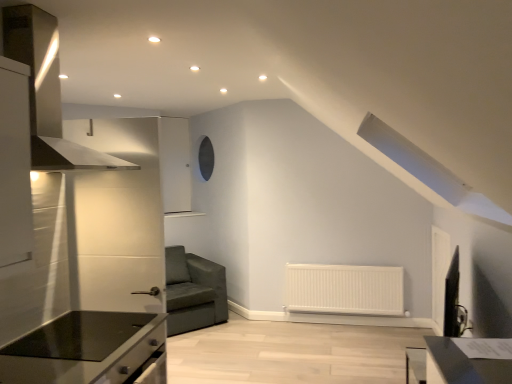
You are a GUI agent. You are given a task and a screenshot of the screen. Output one action in this format:
    pyautogui.click(x=<x>, y=<y>)
    Task: Click on the white matte radiator at lower center
    This screenshot has height=384, width=512.
    Given the screenshot: What is the action you would take?
    pyautogui.click(x=344, y=289)

Measure the distance between point (192,313) and camera.

They are 4.46 meters apart.

Image resolution: width=512 pixels, height=384 pixels. I want to click on white matte radiator at lower center, so [x=344, y=289].

Is black glass countertop at lower left at the back of stainless steel exhaust hood at left?

No.

Considering the sizes of objects stainless steel exhaust hood at left and black glass countertop at lower left in the image provided, who is bigger, stainless steel exhaust hood at left or black glass countertop at lower left?

With larger size is stainless steel exhaust hood at left.

From the picture: From a real-world perspective, which is physically above, stainless steel exhaust hood at left or black glass countertop at lower left?

In real-world perspective, stainless steel exhaust hood at left is above.

Considering the sizes of objects stainless steel exhaust hood at left and black glass countertop at lower left in the image provided, who is shorter, stainless steel exhaust hood at left or black glass countertop at lower left?

Standing shorter between the two is black glass countertop at lower left.

Is dark gray fabric couch at lower left inside or outside of white matte radiator at lower center?

dark gray fabric couch at lower left is not enclosed by white matte radiator at lower center.

Which object is positioned more to the right, dark gray fabric couch at lower left or white matte radiator at lower center?

white matte radiator at lower center is more to the right.

In terms of height, does dark gray fabric couch at lower left look taller or shorter compared to white matte radiator at lower center?

Considering their sizes, dark gray fabric couch at lower left has more height than white matte radiator at lower center.

Is point (185, 255) closer or farther from the camera than point (311, 291)?

Point (185, 255) is farther from the camera than point (311, 291).

Does white matte radiator at lower center have a lesser width compared to stainless steel exhaust hood at left?

Indeed, white matte radiator at lower center has a lesser width compared to stainless steel exhaust hood at left.

How many degrees apart are the facing directions of white matte radiator at lower center and stainless steel exhaust hood at left?

90.5 degrees.

From a real-world perspective, who is located lower, white matte radiator at lower center or stainless steel exhaust hood at left?

white matte radiator at lower center is physically lower.

Is white matte radiator at lower center facing towards stainless steel exhaust hood at left?

No, white matte radiator at lower center is not aimed at stainless steel exhaust hood at left.

Is stainless steel exhaust hood at left to the left of dark gray fabric couch at lower left from the viewer's perspective?

Yes.

Can you confirm if stainless steel exhaust hood at left is smaller than dark gray fabric couch at lower left?

Correct, stainless steel exhaust hood at left occupies less space than dark gray fabric couch at lower left.

Measure the distance between stainless steel exhaust hood at left and dark gray fabric couch at lower left.

They are 2.79 meters apart.

How different are the orientations of stainless steel exhaust hood at left and dark gray fabric couch at lower left in degrees?

45.2 degrees separate the facing orientations of stainless steel exhaust hood at left and dark gray fabric couch at lower left.

Is dark gray fabric couch at lower left in front of or behind stainless steel exhaust hood at left in the image?

Clearly, dark gray fabric couch at lower left is behind stainless steel exhaust hood at left.

From a real-world perspective, between dark gray fabric couch at lower left and stainless steel exhaust hood at left, who is vertically lower?

From a 3D spatial view, dark gray fabric couch at lower left is below.

Considering the sizes of dark gray fabric couch at lower left and stainless steel exhaust hood at left in the image, is dark gray fabric couch at lower left taller or shorter than stainless steel exhaust hood at left?

Clearly, dark gray fabric couch at lower left is taller compared to stainless steel exhaust hood at left.

From the image's perspective, who appears lower, dark gray fabric couch at lower left or stainless steel exhaust hood at left?

dark gray fabric couch at lower left is shown below in the image.

How different are the orientations of white matte radiator at lower center and dark gray fabric couch at lower left in degrees?

There is a 45.3-degree angle between the facing directions of white matte radiator at lower center and dark gray fabric couch at lower left.

Does point (383, 279) appear closer or farther from the camera than point (185, 294)?

Point (383, 279) appears to be closer to the viewer than point (185, 294).

Is white matte radiator at lower center turned away from dark gray fabric couch at lower left?

No, dark gray fabric couch at lower left is not at the back of white matte radiator at lower center.

Is white matte radiator at lower center wider or thinner than dark gray fabric couch at lower left?

white matte radiator at lower center is thinner than dark gray fabric couch at lower left.

Is black glass countertop at lower left positioned beyond the bounds of stainless steel exhaust hood at left?

Yes, black glass countertop at lower left is outside of stainless steel exhaust hood at left.

Is black glass countertop at lower left far away from stainless steel exhaust hood at left?

black glass countertop at lower left is far away from stainless steel exhaust hood at left.

From the image's perspective, is black glass countertop at lower left positioned above or below stainless steel exhaust hood at left?

black glass countertop at lower left is below stainless steel exhaust hood at left.

Considering the sizes of objects black glass countertop at lower left and stainless steel exhaust hood at left in the image provided, who is taller, black glass countertop at lower left or stainless steel exhaust hood at left?

stainless steel exhaust hood at left is taller.

The width and height of the screenshot is (512, 384). What are the coordinates of `exhaust hood located on the left of black glass countertop at lower left` in the screenshot? It's located at (47, 92).

The image size is (512, 384). I want to click on radiator located underneath the dark gray fabric couch at lower left (from a real-world perspective), so pos(344,289).

Estimate the real-world distances between objects in this image. Which object is further from stainless steel exhaust hood at left, dark gray fabric couch at lower left or white matte radiator at lower center?

white matte radiator at lower center is further to stainless steel exhaust hood at left.

From the image, which object appears to be farther from dark gray fabric couch at lower left, stainless steel exhaust hood at left or white matte radiator at lower center?

stainless steel exhaust hood at left is positioned further to the anchor dark gray fabric couch at lower left.

When comparing their distances from white matte radiator at lower center, does dark gray fabric couch at lower left or stainless steel exhaust hood at left seem further?

stainless steel exhaust hood at left is further to white matte radiator at lower center.

Considering their positions, is black glass countertop at lower left positioned further to white matte radiator at lower center than stainless steel exhaust hood at left?

stainless steel exhaust hood at left is positioned further to the anchor white matte radiator at lower center.

When comparing their distances from white matte radiator at lower center, does dark gray fabric couch at lower left or black glass countertop at lower left seem further?

black glass countertop at lower left lies further to white matte radiator at lower center than the other object.

Which object lies nearer to the anchor point dark gray fabric couch at lower left, stainless steel exhaust hood at left or black glass countertop at lower left?

Among the two, black glass countertop at lower left is located nearer to dark gray fabric couch at lower left.

Which object lies further to the anchor point black glass countertop at lower left, stainless steel exhaust hood at left or white matte radiator at lower center?

white matte radiator at lower center is further to black glass countertop at lower left.

From the image, which object appears to be nearer to black glass countertop at lower left, white matte radiator at lower center or stainless steel exhaust hood at left?

Among the two, stainless steel exhaust hood at left is located nearer to black glass countertop at lower left.

The height and width of the screenshot is (384, 512). I want to click on countertop positioned between stainless steel exhaust hood at left and dark gray fabric couch at lower left from near to far, so click(x=88, y=350).

Identify the location of countertop between stainless steel exhaust hood at left and white matte radiator at lower center along the z-axis. The width and height of the screenshot is (512, 384). (88, 350).

This screenshot has width=512, height=384. In order to click on studio couch located between black glass countertop at lower left and white matte radiator at lower center in the depth direction in this screenshot , I will do `click(193, 291)`.

The height and width of the screenshot is (384, 512). In order to click on studio couch located between stainless steel exhaust hood at left and white matte radiator at lower center in the depth direction in this screenshot , I will do `click(193, 291)`.